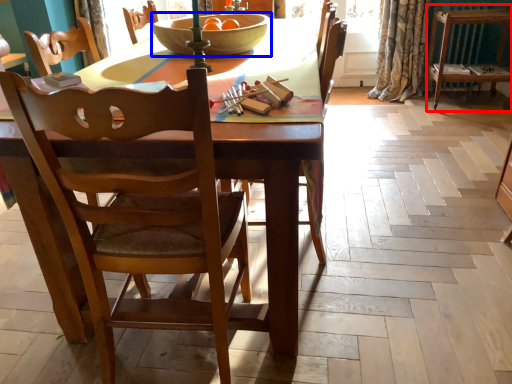
Question: Which object is further to the camera taking this photo, dresser (highlighted by a red box) or bowl (highlighted by a blue box)?

Choices:
 (A) dresser
 (B) bowl

Answer: (A)